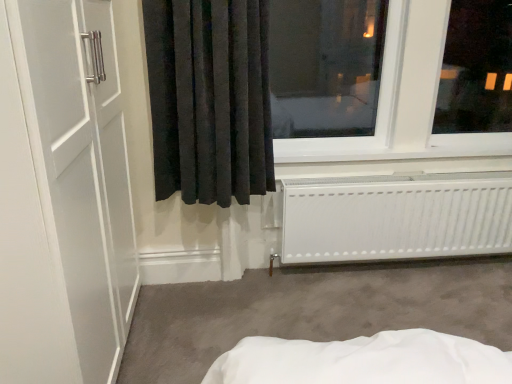
Question: Would you say black velvet curtain at center is to the left or to the right of white plastic window sill at lower center in the picture?

Choices:
 (A) right
 (B) left

Answer: (B)

Question: From the image's perspective, is black velvet curtain at center positioned above or below white plastic window sill at lower center?

Choices:
 (A) below
 (B) above

Answer: (B)

Question: Which of these objects is positioned farthest from the white matte radiator at lower right?

Choices:
 (A) black velvet curtain at center
 (B) white plastic window sill at lower center
 (C) transparent glass window at upper right

Answer: (A)

Question: Estimate the real-world distances between objects in this image. Which object is closer to the white plastic window sill at lower center?

Choices:
 (A) black velvet curtain at center
 (B) transparent glass window at upper right
 (C) white matte radiator at lower right

Answer: (B)